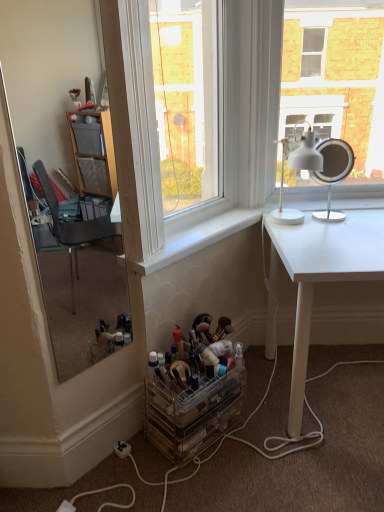
Image resolution: width=384 pixels, height=512 pixels. Identify the location of free region under clear glass window at center (from a real-world perspective). (202, 227).